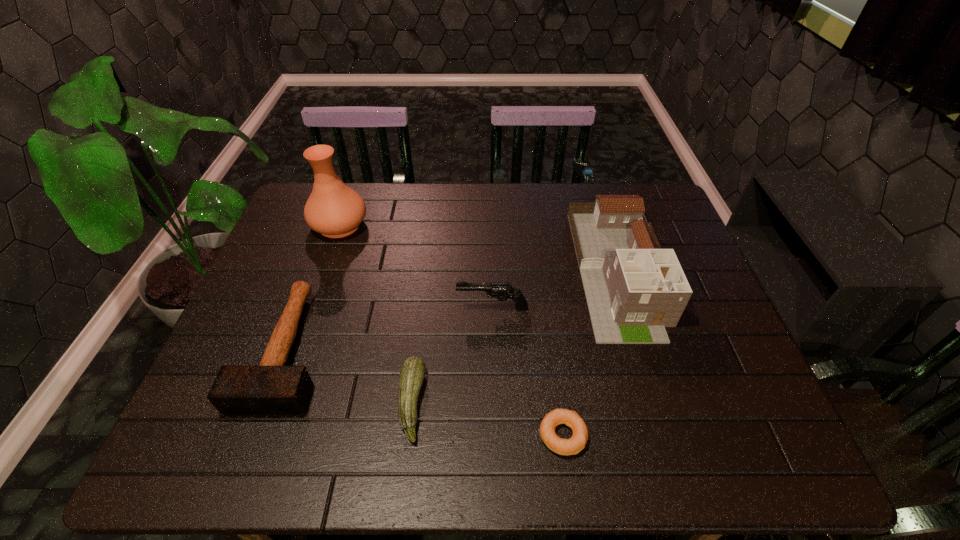
At what (x,y) coordinates should I click in order to perform the action: click on vacant space that is in between the shortest object and the second shortest object. Please return your answer as a coordinate pair (x, y). The image size is (960, 540). Looking at the image, I should click on (487, 418).

The image size is (960, 540). Find the location of `free space that is in between the fourth tallest object and the vase`. free space that is in between the fourth tallest object and the vase is located at coordinates (314, 286).

Locate an element on the screen. vacant space in between the fifth tallest object and the tallest object is located at coordinates (375, 314).

Image resolution: width=960 pixels, height=540 pixels. Find the location of `unoccupied area between the second tallest object and the shortest object`. unoccupied area between the second tallest object and the shortest object is located at coordinates (589, 353).

At what (x,y) coordinates should I click in order to perform the action: click on free spot between the third shortest object and the second tallest object. Please return your answer as a coordinate pair (x, y). This screenshot has height=540, width=960. Looking at the image, I should click on (452, 309).

Identify the location of vacant space in between the tallest object and the rightmost object. (478, 247).

Locate an element on the screen. Image resolution: width=960 pixels, height=540 pixels. free space that is in between the third tallest object and the mallet is located at coordinates (390, 328).

Where is `vacant region between the mallet and the bagel`? Image resolution: width=960 pixels, height=540 pixels. vacant region between the mallet and the bagel is located at coordinates (425, 392).

Locate an element on the screen. The image size is (960, 540). unoccupied position between the zucchini and the bagel is located at coordinates (487, 418).

Find the location of `vacant space that's between the tallest object and the gun`. vacant space that's between the tallest object and the gun is located at coordinates (416, 266).